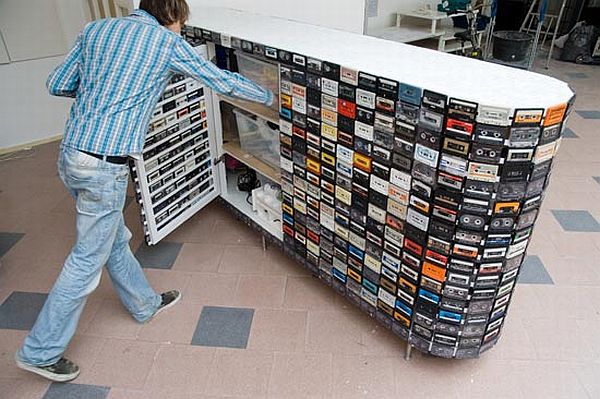
I want to click on door, so click(189, 149).